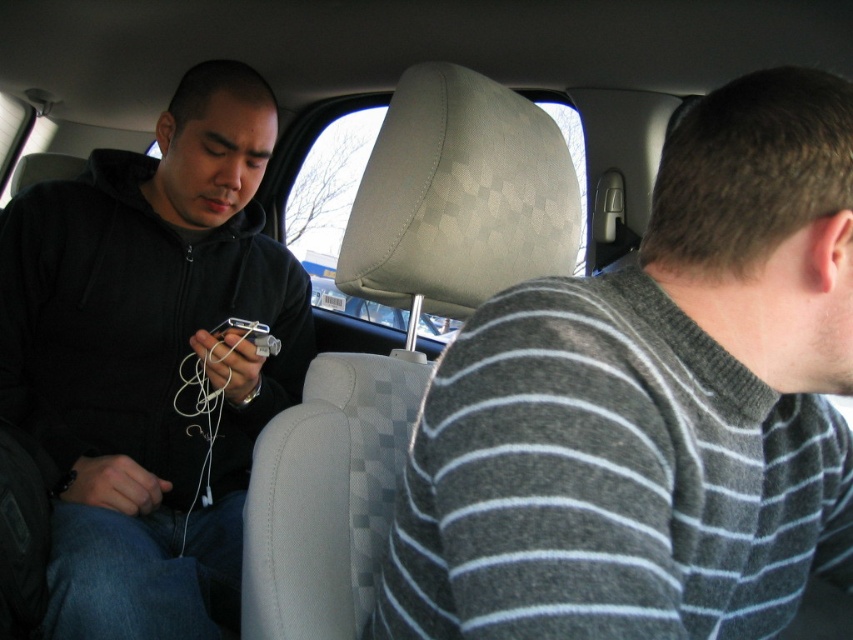
Question: Which point is closer to the camera taking this photo?

Choices:
 (A) (634, 378)
 (B) (173, 275)

Answer: (A)

Question: Can you confirm if gray striped sweater at right is bigger than black matte hoodie at left?

Choices:
 (A) no
 (B) yes

Answer: (A)

Question: Is gray striped sweater at right in front of black matte hoodie at left?

Choices:
 (A) yes
 (B) no

Answer: (A)

Question: Which point is farther to the camera?

Choices:
 (A) (183, 509)
 (B) (756, 312)

Answer: (A)

Question: Which point is farther to the camera?

Choices:
 (A) (720, 294)
 (B) (74, 253)

Answer: (B)

Question: Where is gray striped sweater at right located in relation to black matte hoodie at left in the image?

Choices:
 (A) above
 (B) below

Answer: (B)